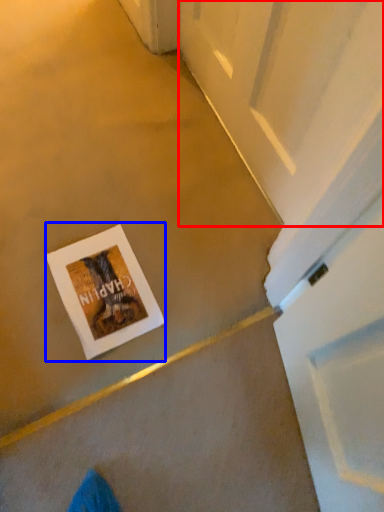
Question: Among these objects, which one is farthest to the camera, screen door (highlighted by a red box) or postcard (highlighted by a blue box)?

Choices:
 (A) screen door
 (B) postcard

Answer: (B)